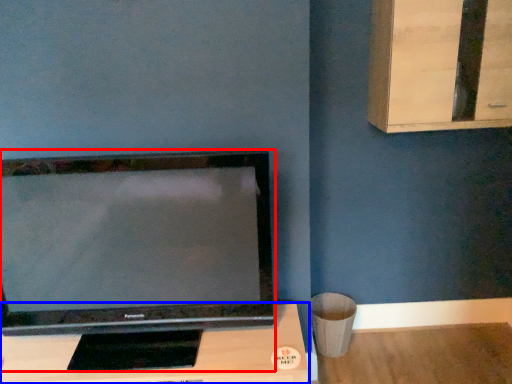
Question: Which of the following is the closest to the observer, television (highlighted by a red box) or furniture (highlighted by a blue box)?

Choices:
 (A) television
 (B) furniture

Answer: (A)